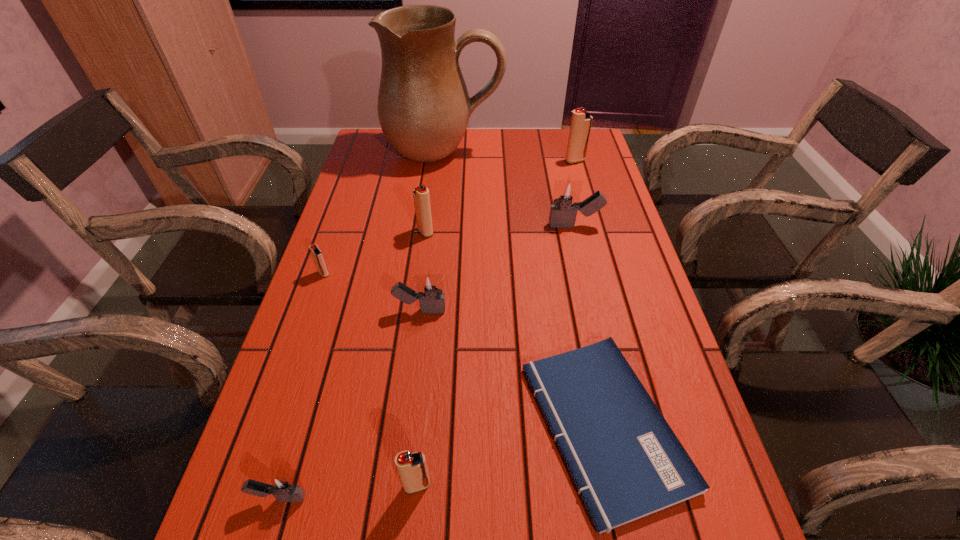
At what (x,y) coordinates should I click in order to perform the action: click on free location located 0.310m on the right of the nearest red igniter. Please return your answer as a coordinate pair (x, y). This screenshot has height=540, width=960. Looking at the image, I should click on (613, 485).

At what (x,y) coordinates should I click in order to perform the action: click on vacant space located on the front of the fifth nearest object. Please return your answer as a coordinate pair (x, y). The image size is (960, 540). Looking at the image, I should click on (280, 401).

Identify the location of vacant position located on the back of the nearest gray igniter. This screenshot has width=960, height=540. (322, 354).

You are a GUI agent. You are given a task and a screenshot of the screen. Output one action in this format:
    pyautogui.click(x=<x>, y=<y>)
    Task: Click on the vacant space located on the back of the shortest object
    The width and height of the screenshot is (960, 540).
    Given the screenshot: What is the action you would take?
    pyautogui.click(x=564, y=233)

Identify the location of cream pitcher that is at the far edge. The width and height of the screenshot is (960, 540). (424, 107).

Find the location of a particular element. igniter that is positioned at the far edge is located at coordinates (581, 121).

Where is `cream pitcher situated at the left edge`? The image size is (960, 540). cream pitcher situated at the left edge is located at coordinates (424, 107).

This screenshot has height=540, width=960. I want to click on paperback book located at the right edge, so click(x=626, y=462).

Where is `object that is at the far left corner`? object that is at the far left corner is located at coordinates [424, 107].

Where is `object situated at the far right corner`? object situated at the far right corner is located at coordinates (581, 121).